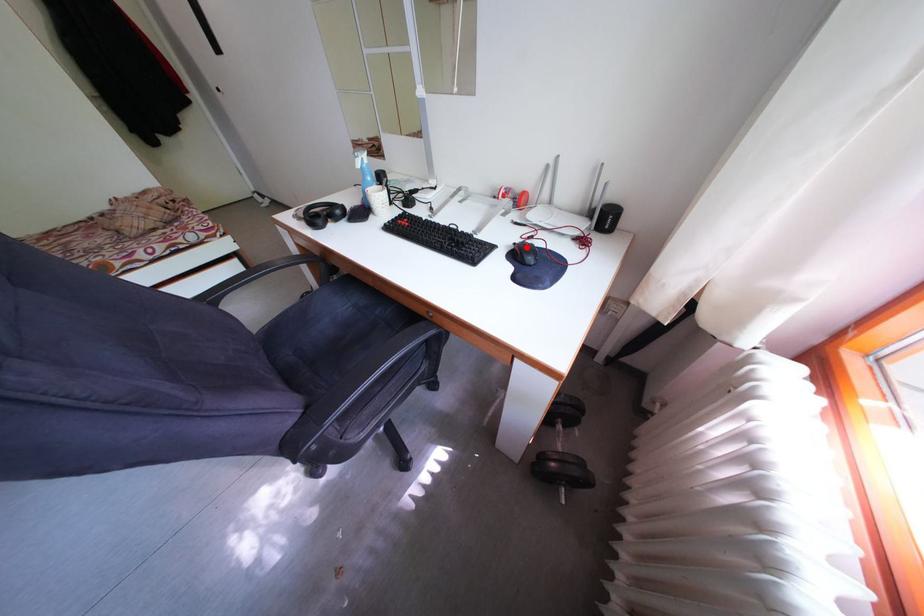
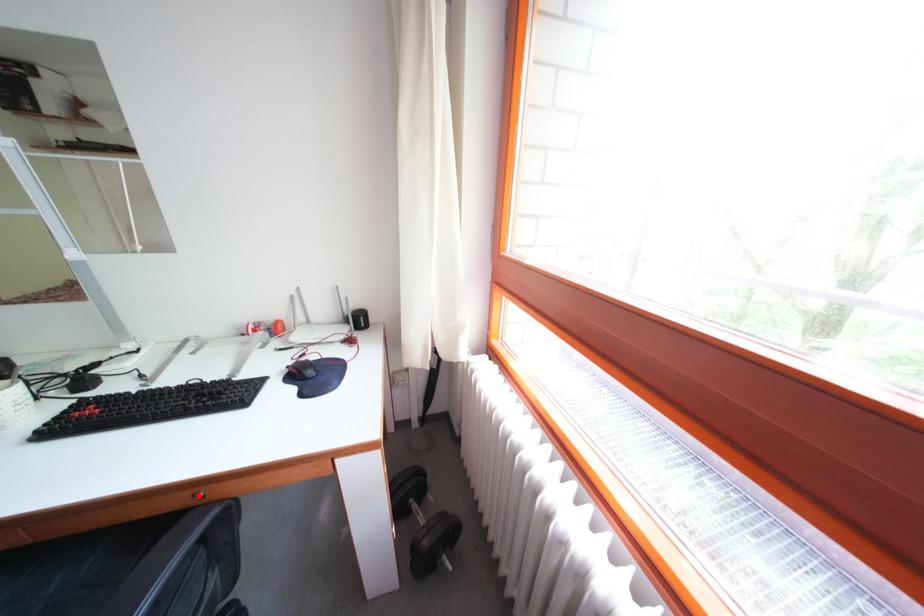
I am providing you with two images of the same scene from different viewpoints. A red point is marked on the first image and another point is marked on the second image. Do the highlighted points in image1 and image2 indicate the same real-world spot?

No